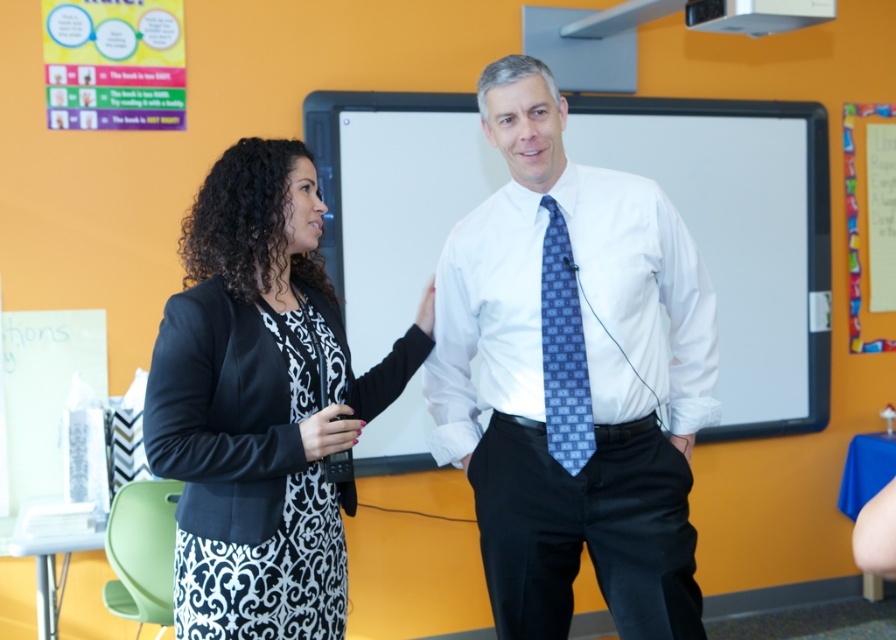
At what (x,y) coordinates should I click in order to perform the action: click on white smooth shirt at center. Please return your answer as a coordinate pair (x, y). The image size is (896, 640). Looking at the image, I should click on (571, 376).

Does white smooth shirt at center appear on the left side of black matte blazer at center?

A: In fact, white smooth shirt at center is to the right of black matte blazer at center.

The width and height of the screenshot is (896, 640). What do you see at coordinates (571, 376) in the screenshot?
I see `white smooth shirt at center` at bounding box center [571, 376].

The image size is (896, 640). In order to click on white smooth shirt at center in this screenshot , I will do `click(571, 376)`.

Who is shorter, whiteboard at center or black matte blazer at center?

With less height is black matte blazer at center.

This screenshot has width=896, height=640. I want to click on whiteboard at center, so click(739, 236).

Does black matte blazer at center have a lesser width compared to blue patterned tie at center?

In fact, black matte blazer at center might be wider than blue patterned tie at center.

Who is higher up, black matte blazer at center or blue patterned tie at center?

blue patterned tie at center

This screenshot has height=640, width=896. Describe the element at coordinates (263, 404) in the screenshot. I see `black matte blazer at center` at that location.

Image resolution: width=896 pixels, height=640 pixels. What are the coordinates of `black matte blazer at center` in the screenshot? It's located at (263, 404).